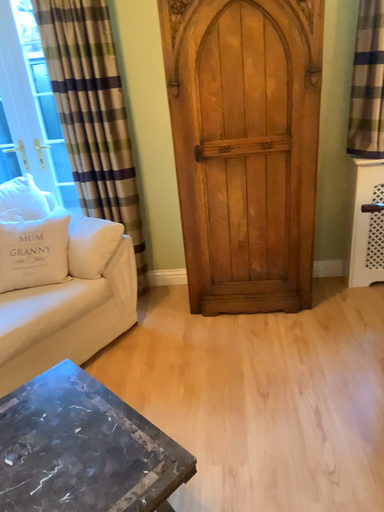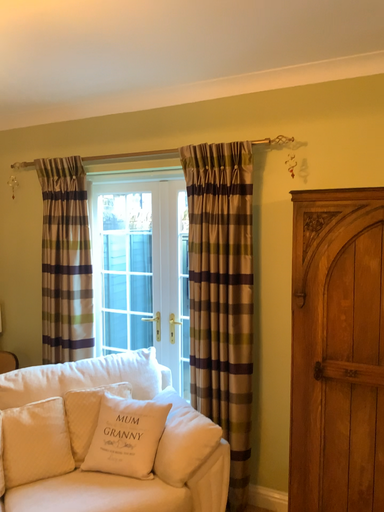
Question: Which way did the camera rotate in the video?

Choices:
 (A) rotated upward
 (B) rotated downward

Answer: (A)